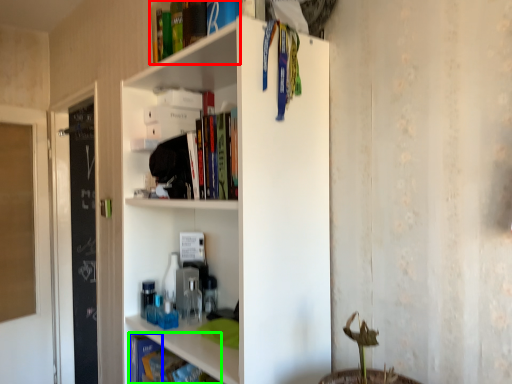
Question: Estimate the real-world distances between objects in this image. Which object is farther from book (highlighted by a red box), book (highlighted by a blue box) or book (highlighted by a green box)?

Choices:
 (A) book
 (B) book

Answer: (A)